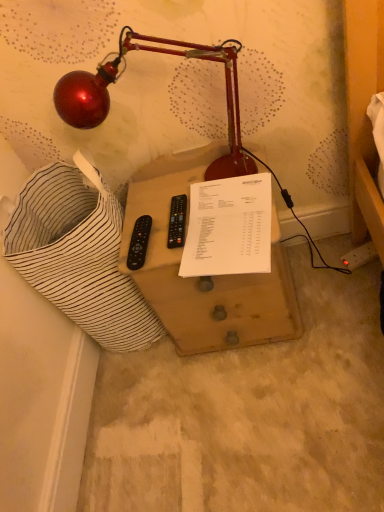
This screenshot has width=384, height=512. Find the location of `vacant area on top of wooden drawer at center (from a real-world perspective)`. vacant area on top of wooden drawer at center (from a real-world perspective) is located at coordinates (189, 214).